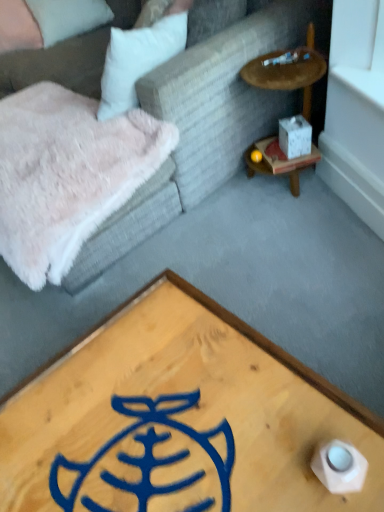
What is the approximate width of velvet fabric couch at upper left?

The width of velvet fabric couch at upper left is 3.77 feet.

Locate an element on the screen. velvet fabric couch at upper left is located at coordinates (228, 93).

Measure the distance between beige fabric pillow at upper left, the 1th pillow in the right-to-left sequence, and camera.

beige fabric pillow at upper left, the 1th pillow in the right-to-left sequence, and camera are 2.54 meters apart from each other.

Identify the location of fuzzy pink blanket at upper left. The image size is (384, 512). (67, 174).

Identify the location of white fluffy pillow at upper left, acting as the 2th pillow starting from the right. This screenshot has width=384, height=512. (18, 27).

Is wooden coffee table at center bigger or smaller than white fluffy pillow at upper left, acting as the 2th pillow starting from the right?

In the image, wooden coffee table at center appears to be larger than white fluffy pillow at upper left, acting as the 2th pillow starting from the right.

Between point (228, 360) and point (22, 20), which one is positioned behind?

The point (22, 20) is more distant.

Would you consider wooden coffee table at center to be distant from white fluffy pillow at upper left, which is the 1th pillow in left-to-right order?

wooden coffee table at center is positioned a significant distance from white fluffy pillow at upper left, which is the 1th pillow in left-to-right order.

Between white fluffy pillow at upper left, acting as the 2th pillow starting from the right, and velvet fabric couch at upper left, which one has smaller width?

white fluffy pillow at upper left, acting as the 2th pillow starting from the right, is thinner.

Considering the relative sizes of white fluffy pillow at upper left, acting as the 2th pillow starting from the right, and velvet fabric couch at upper left in the image provided, is white fluffy pillow at upper left, acting as the 2th pillow starting from the right, taller than velvet fabric couch at upper left?

No, white fluffy pillow at upper left, acting as the 2th pillow starting from the right, is not taller than velvet fabric couch at upper left.

Considering the sizes of objects white fluffy pillow at upper left, acting as the 2th pillow starting from the right, and velvet fabric couch at upper left in the image provided, who is smaller, white fluffy pillow at upper left, acting as the 2th pillow starting from the right, or velvet fabric couch at upper left?

Smaller between the two is white fluffy pillow at upper left, acting as the 2th pillow starting from the right.

Are white fluffy pillow at upper left, which is the 1th pillow in left-to-right order, and velvet fabric couch at upper left beside each other?

white fluffy pillow at upper left, which is the 1th pillow in left-to-right order, and velvet fabric couch at upper left are not in contact.

Looking at this image, is fuzzy pink blanket at upper left far away from beige fabric pillow at upper left, which is counted as the second pillow, starting from the left?

Yes, fuzzy pink blanket at upper left and beige fabric pillow at upper left, which is counted as the second pillow, starting from the left, are located far from each other.

Looking at this image, from a real-world perspective, which is physically below, fuzzy pink blanket at upper left or beige fabric pillow at upper left, the 1th pillow in the right-to-left sequence?

fuzzy pink blanket at upper left is physically lower.

Is fuzzy pink blanket at upper left bigger than beige fabric pillow at upper left, the 1th pillow in the right-to-left sequence?

Indeed, fuzzy pink blanket at upper left has a larger size compared to beige fabric pillow at upper left, the 1th pillow in the right-to-left sequence.

Is fuzzy pink blanket at upper left positioned with its back to beige fabric pillow at upper left, the 1th pillow in the right-to-left sequence?

No, fuzzy pink blanket at upper left's orientation is not away from beige fabric pillow at upper left, the 1th pillow in the right-to-left sequence.

How many degrees apart are the facing directions of fuzzy pink blanket at upper left and white matte cube at right?

31.4 degrees separate the facing orientations of fuzzy pink blanket at upper left and white matte cube at right.

From a real-world perspective, which is physically above, fuzzy pink blanket at upper left or white matte cube at right?

From a 3D spatial view, fuzzy pink blanket at upper left is above.

Is fuzzy pink blanket at upper left wider than white matte cube at right?

Yes, fuzzy pink blanket at upper left is wider than white matte cube at right.

Is fuzzy pink blanket at upper left taller or shorter than white matte cube at right?

fuzzy pink blanket at upper left is taller than white matte cube at right.

From a real-world perspective, does fuzzy pink blanket at upper left stand above white fluffy pillow at upper left, acting as the 2th pillow starting from the right?

No, from a real-world perspective, fuzzy pink blanket at upper left is not on top of white fluffy pillow at upper left, acting as the 2th pillow starting from the right.

Does fuzzy pink blanket at upper left touch white fluffy pillow at upper left, which is the 1th pillow in left-to-right order?

No, fuzzy pink blanket at upper left is not beside white fluffy pillow at upper left, which is the 1th pillow in left-to-right order.

Find the location of `the 1st pillow behind the fuzzy pink blanket at upper left, counting from the anchor's position`. the 1st pillow behind the fuzzy pink blanket at upper left, counting from the anchor's position is located at coordinates (18, 27).

Would you say fuzzy pink blanket at upper left is outside white fluffy pillow at upper left, which is the 1th pillow in left-to-right order?

fuzzy pink blanket at upper left is positioned outside white fluffy pillow at upper left, which is the 1th pillow in left-to-right order.

Is wooden at right located within fuzzy pink blanket at upper left?

Definitely not — wooden at right is not inside fuzzy pink blanket at upper left.

Which of these two, fuzzy pink blanket at upper left or wooden at right, is wider?

With larger width is fuzzy pink blanket at upper left.

From a real-world perspective, is fuzzy pink blanket at upper left positioned above or below wooden at right?

From a real-world perspective, fuzzy pink blanket at upper left is physically below wooden at right.

How many degrees apart are the facing directions of fuzzy pink blanket at upper left and wooden at right?

They differ by 0.0509 degrees in their facing directions.

Can beige fabric pillow at upper left, the 1th pillow in the right-to-left sequence, be found inside wooden at right?

No, beige fabric pillow at upper left, the 1th pillow in the right-to-left sequence, is not inside wooden at right.

Can you confirm if wooden at right is thinner than beige fabric pillow at upper left, the 1th pillow in the right-to-left sequence?

Yes.

Which is behind, point (309, 103) or point (79, 32)?

The point (79, 32) is farther from the camera.

From a real-world perspective, which is physically below, wooden at right or beige fabric pillow at upper left, which is counted as the second pillow, starting from the left?

From a 3D spatial view, wooden at right is below.

Where is `coffee table on the right of the white fluffy pillow at upper left, acting as the 2th pillow starting from the right`? The width and height of the screenshot is (384, 512). coffee table on the right of the white fluffy pillow at upper left, acting as the 2th pillow starting from the right is located at coordinates (179, 418).

From the image's perspective, which pillow is the 1st one above the velvet fabric couch at upper left? Please provide its 2D coordinates.

[(18, 27)]

Estimate the real-world distances between objects in this image. Which object is closer to wooden at right, white fluffy pillow at upper left, acting as the 2th pillow starting from the right, or wooden coffee table at center?

Based on the image, wooden coffee table at center appears to be nearer to wooden at right.

Estimate the real-world distances between objects in this image. Which object is further from velvet fabric couch at upper left, wooden coffee table at center or fuzzy pink blanket at upper left?

wooden coffee table at center.

When comparing their distances from white matte cube at right, does beige fabric pillow at upper left, the 1th pillow in the right-to-left sequence, or fuzzy pink blanket at upper left seem further?

beige fabric pillow at upper left, the 1th pillow in the right-to-left sequence, is further to white matte cube at right.

Looking at the image, which one is located closer to wooden coffee table at center, beige fabric pillow at upper left, the 1th pillow in the right-to-left sequence, or velvet fabric couch at upper left?

velvet fabric couch at upper left lies closer to wooden coffee table at center than the other object.

Considering their positions, is wooden at right positioned further to beige fabric pillow at upper left, the 1th pillow in the right-to-left sequence, than white matte cube at right?

white matte cube at right is positioned further to the anchor beige fabric pillow at upper left, the 1th pillow in the right-to-left sequence.

From the image, which object appears to be farther from white fluffy pillow at upper left, which is the 1th pillow in left-to-right order, white matte cube at right or fuzzy pink blanket at upper left?

The object further to white fluffy pillow at upper left, which is the 1th pillow in left-to-right order, is white matte cube at right.

Considering their positions, is velvet fabric couch at upper left positioned further to white matte cube at right than wooden at right?

velvet fabric couch at upper left is positioned further to the anchor white matte cube at right.

Considering their positions, is white fluffy pillow at upper left, acting as the 2th pillow starting from the right, positioned closer to velvet fabric couch at upper left than wooden coffee table at center?

Based on the image, wooden coffee table at center appears to be nearer to velvet fabric couch at upper left.

This screenshot has height=512, width=384. What are the coordinates of `pillow between white fluffy pillow at upper left, acting as the 2th pillow starting from the right, and wooden at right from left to right` in the screenshot? It's located at (68, 17).

The height and width of the screenshot is (512, 384). What are the coordinates of `pillow between fuzzy pink blanket at upper left and beige fabric pillow at upper left, which is counted as the second pillow, starting from the left, in the front-back direction` in the screenshot? It's located at (18, 27).

Find the location of a particular element. The height and width of the screenshot is (512, 384). cocktail table between white fluffy pillow at upper left, which is the 1th pillow in left-to-right order, and wooden coffee table at center vertically is located at coordinates (289, 71).

In order to click on blanket between wooden at right and wooden coffee table at center vertically in this screenshot , I will do `click(67, 174)`.